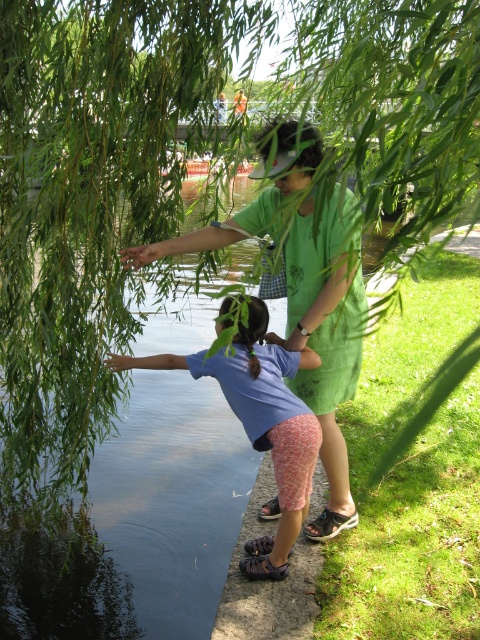
Question: Which point is closer to the camera?

Choices:
 (A) (317, 388)
 (B) (275, 561)

Answer: (B)

Question: Which point is farther from the camera taking this photo?

Choices:
 (A) (251, 381)
 (B) (319, 333)

Answer: (B)

Question: Is green cotton shirt at center thinner than blue cotton shirt at lower left?

Choices:
 (A) no
 (B) yes

Answer: (A)

Question: Observing the image, what is the correct spatial positioning of green cotton shirt at center in reference to blue cotton shirt at lower left?

Choices:
 (A) right
 (B) left

Answer: (A)

Question: Considering the relative positions of green cotton shirt at center and blue cotton shirt at lower left in the image provided, where is green cotton shirt at center located with respect to blue cotton shirt at lower left?

Choices:
 (A) above
 (B) below

Answer: (A)